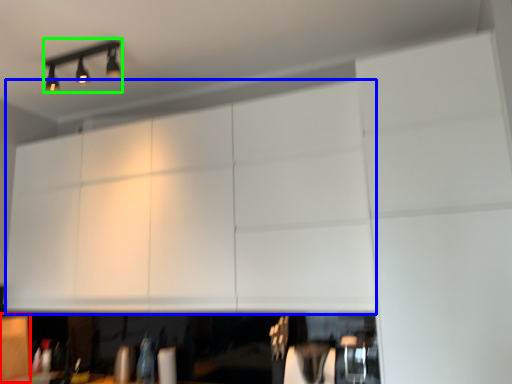
Question: Which object is positioned closest to cabinetry (highlighted by a red box)? Select from cabinetry (highlighted by a blue box) and lamp (highlighted by a green box).

Choices:
 (A) cabinetry
 (B) lamp

Answer: (A)